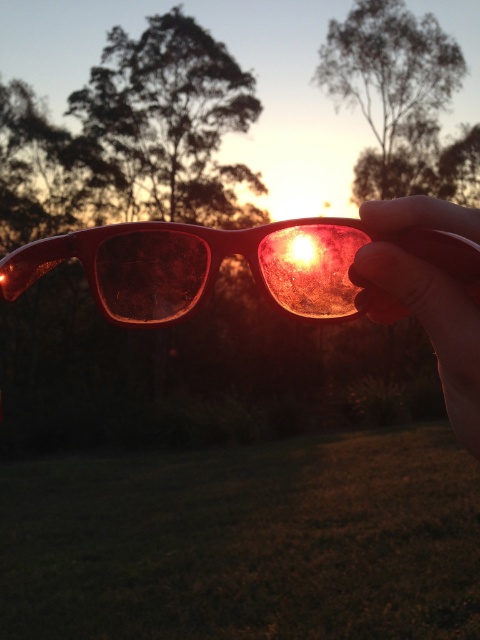
Describe the element at coordinates (230, 253) in the screenshot. The image size is (480, 640). I see `matte plastic goggles at center` at that location.

Can you confirm if matte plastic goggles at center is thinner than matte plastic hand at center?

No.

Is point (58, 243) positioned in front of point (372, 252)?

No, (58, 243) is further to viewer.

Locate an element on the screen. matte plastic goggles at center is located at coordinates (230, 253).